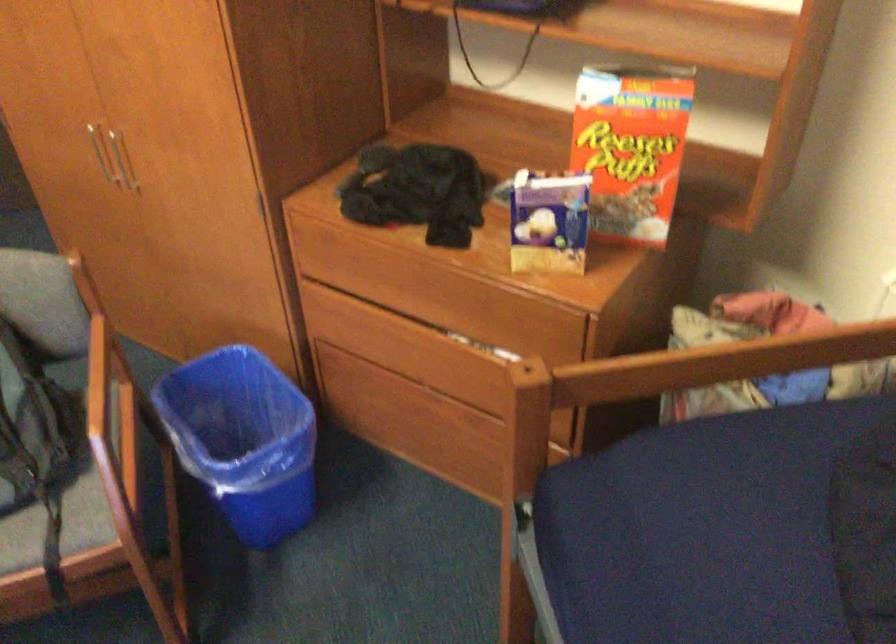
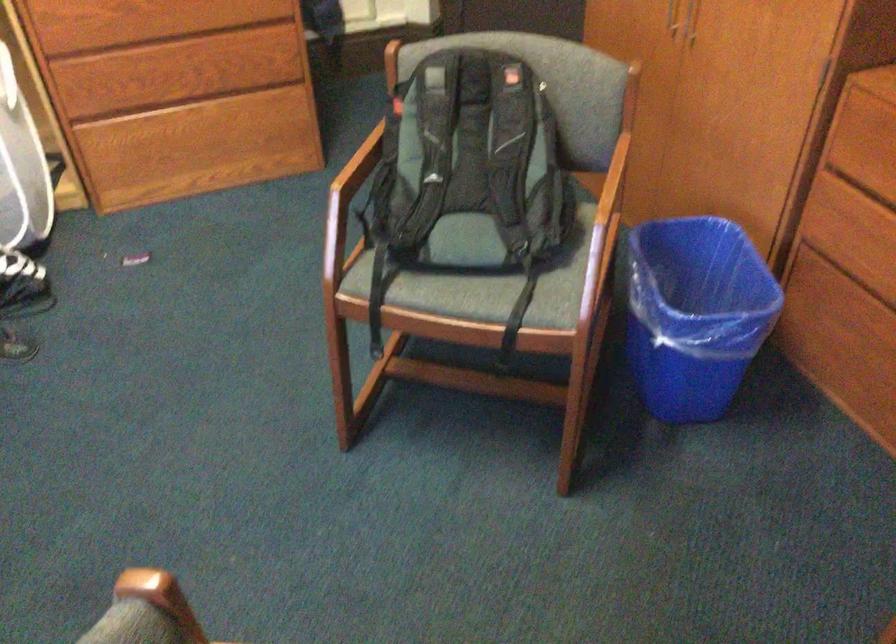
Find the pixel in the second image that matches (247,436) in the first image.

(694, 313)